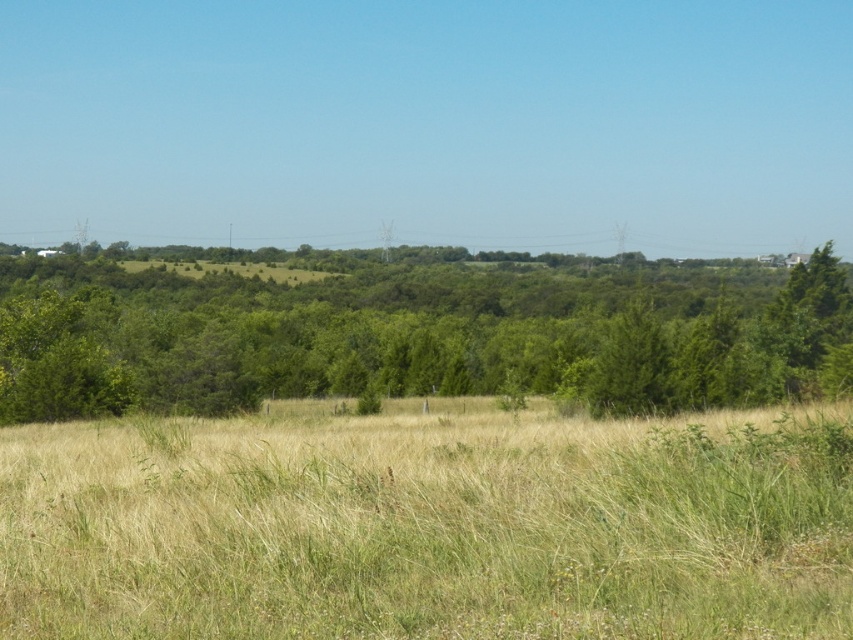
In the scene shown: Does dry grass at center appear on the right side of green leafy tree at center?

Yes, dry grass at center is to the right of green leafy tree at center.

Can you confirm if dry grass at center is positioned below green leafy tree at center?

Yes.

The image size is (853, 640). Describe the element at coordinates (430, 525) in the screenshot. I see `dry grass at center` at that location.

This screenshot has width=853, height=640. In order to click on dry grass at center in this screenshot , I will do `click(430, 525)`.